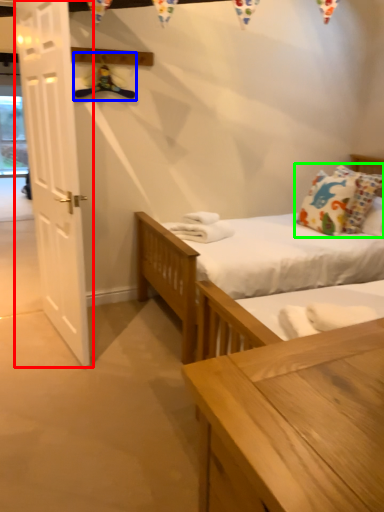
Question: Considering the real-world distances, which object is closest to door (highlighted by a red box)? hanger (highlighted by a blue box) or pillow (highlighted by a green box).

Choices:
 (A) hanger
 (B) pillow

Answer: (A)